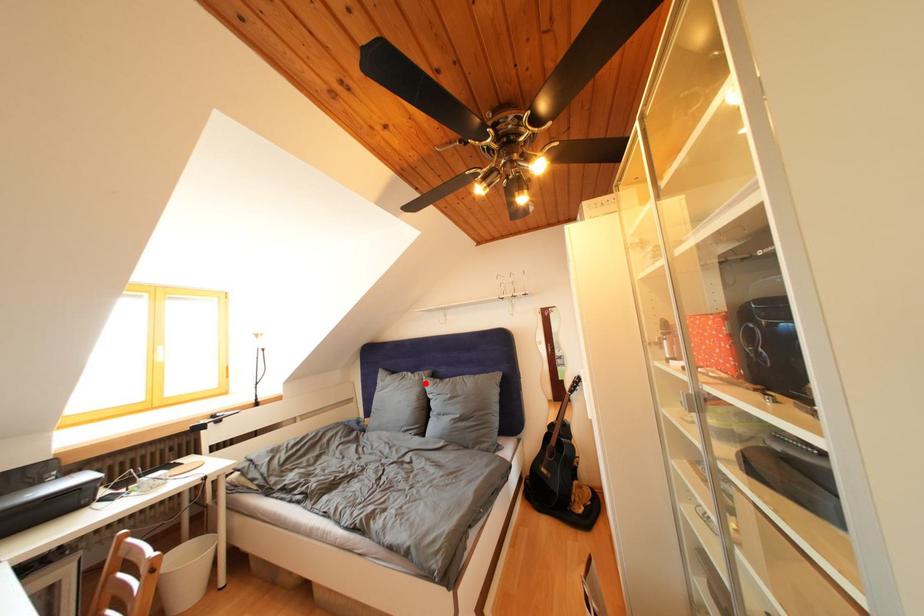
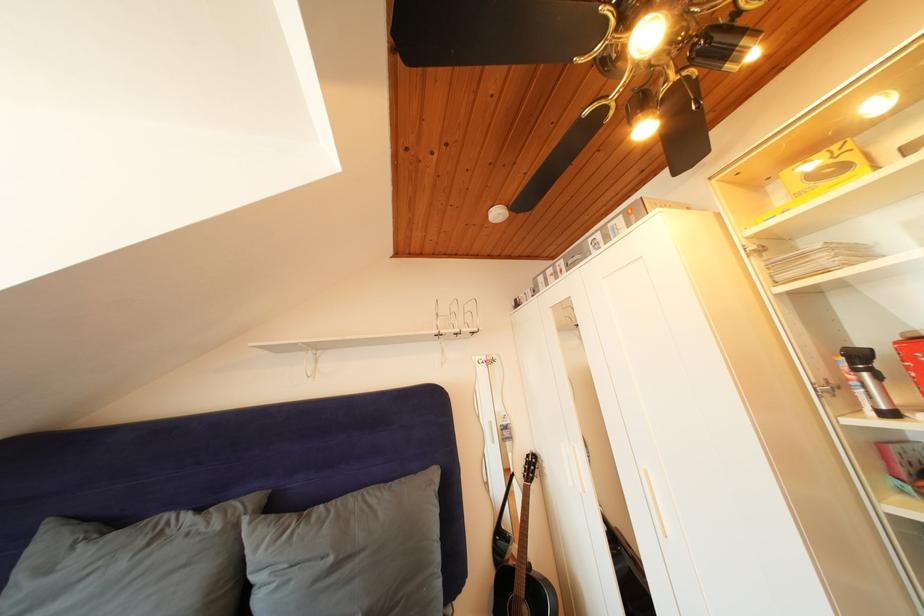
Where in the second image is the point corresponding to the highlighted location from the first image?

(225, 531)